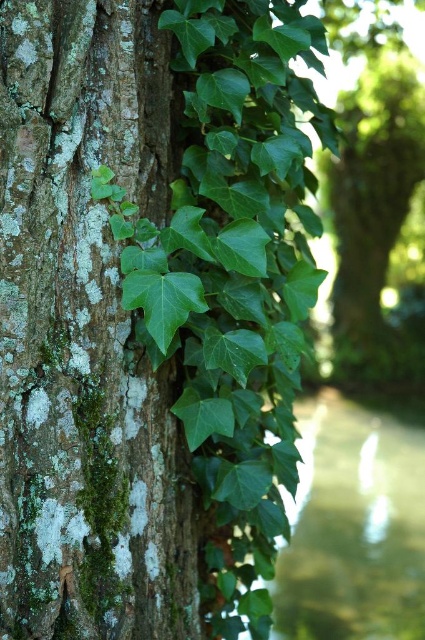
Question: Which point is farther to the camera?

Choices:
 (A) (299, 528)
 (B) (14, 16)

Answer: (A)

Question: Observing the image, what is the correct spatial positioning of green leafy creeks at lower right in reference to green leafy ivy at center?

Choices:
 (A) above
 (B) below

Answer: (B)

Question: Is green leafy creeks at lower right below green leafy ivy at center?

Choices:
 (A) yes
 (B) no

Answer: (A)

Question: Which object is positioned farthest from the green mossy bark at left?

Choices:
 (A) green leafy ivy at center
 (B) green leafy creeks at lower right

Answer: (A)

Question: Can you confirm if green mossy bark at left is positioned below green leafy ivy at center?

Choices:
 (A) yes
 (B) no

Answer: (A)

Question: Which is farther from the green leafy ivy at center?

Choices:
 (A) green mossy bark at left
 (B) green leafy creeks at lower right

Answer: (A)